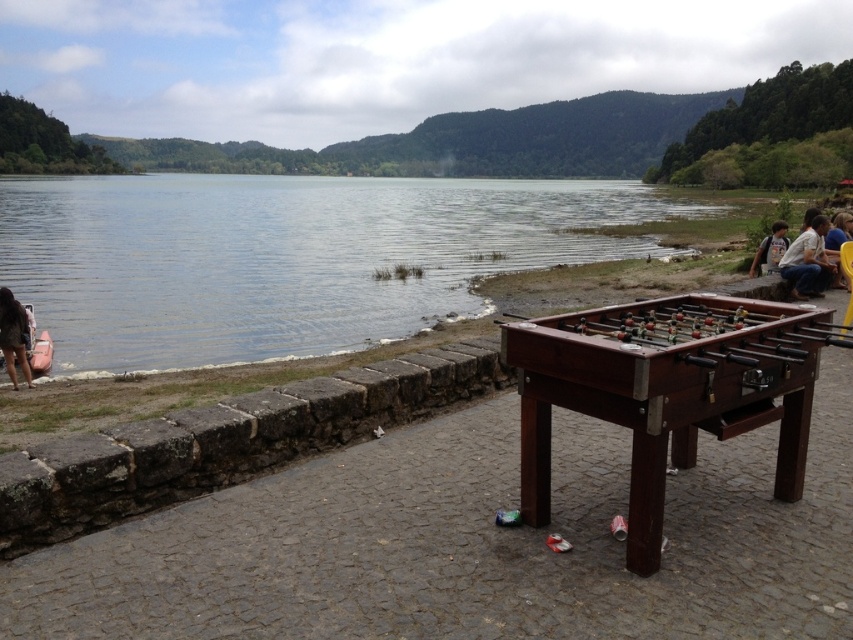
You are planning to take a photo of the clear water at lake left and the white cotton shirt at right. Which object should you focus on first if you want both to be in sharp focus?

The clear water at lake left is larger in size than the white cotton shirt at right, so focusing on the larger object first would help ensure both are in sharp focus.

You are standing at the edge of the lake and want to pick up the white cotton shirt at right without moving from your current position. Is the wooden foosball table at center blocking your direct path to the shirt?

The wooden foosball table at center is closer to the viewer than the white cotton shirt at right, so it is blocking the direct path to the shirt.